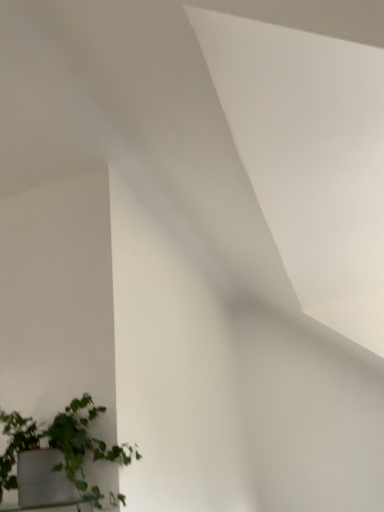
Describe the element at coordinates (62, 446) in the screenshot. This screenshot has height=512, width=384. I see `green matte plant at lower left` at that location.

This screenshot has height=512, width=384. Identify the location of green matte plant at lower left. (62, 446).

Identify the location of green matte plant at lower left. (62, 446).